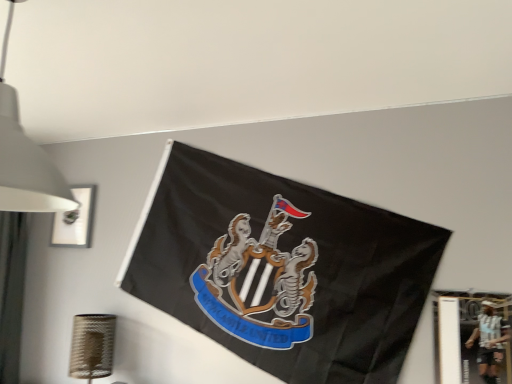
Image resolution: width=512 pixels, height=384 pixels. What do you see at coordinates (472, 337) in the screenshot?
I see `metallic silver picture frame at lower right, arranged as the first picture frame when viewed from the right` at bounding box center [472, 337].

What is the approximate width of metallic silver picture frame at lower right, positioned as the first picture frame in bottom-to-top order?

metallic silver picture frame at lower right, positioned as the first picture frame in bottom-to-top order, is 0.89 inches wide.

You are a GUI agent. You are given a task and a screenshot of the screen. Output one action in this format:
    pyautogui.click(x=<x>, y=<y>)
    Task: Click on the white matte lampshade at upper left
    The height and width of the screenshot is (384, 512).
    Given the screenshot: What is the action you would take?
    pyautogui.click(x=25, y=158)

At what (x,y) coordinates should I click in order to perform the action: click on matte white picture frame at upper left, the 1th picture frame positioned from the top. Please return your answer as a coordinate pair (x, y). This screenshot has height=384, width=512. Looking at the image, I should click on (75, 220).

Is white matte lampshade at upper left completely or partially outside of matte white picture frame at upper left, placed as the 1th picture frame when sorted from left to right?

Yes.

In the image, is white matte lampshade at upper left on the left side or the right side of matte white picture frame at upper left, which is the 1th picture frame from back to front?

From the image, it's evident that white matte lampshade at upper left is to the right of matte white picture frame at upper left, which is the 1th picture frame from back to front.

From the image's perspective, is white matte lampshade at upper left located above matte white picture frame at upper left, the 2th picture frame when ordered from right to left?

Correct, white matte lampshade at upper left appears higher than matte white picture frame at upper left, the 2th picture frame when ordered from right to left, in the image.

Based on the photo, would you consider matte white picture frame at upper left, which appears as the second picture frame when ordered from the bottom, to be distant from white matte lampshade at upper left?

Yes.

Find the location of a particular element. The width and height of the screenshot is (512, 384). picture frame on the left of white matte lampshade at upper left is located at coordinates (75, 220).

Is the position of matte white picture frame at upper left, the second picture frame from the front, less distant than that of white matte lampshade at upper left?

No, matte white picture frame at upper left, the second picture frame from the front, is further to the viewer.

Measure the distance from matte white picture frame at upper left, which is the 1th picture frame from back to front, to white matte lampshade at upper left.

matte white picture frame at upper left, which is the 1th picture frame from back to front, and white matte lampshade at upper left are 1.68 meters apart from each other.

Considering the positions of objects white matte lampshade at upper left and metallic silver picture frame at lower right, arranged as the second picture frame when viewed from the left, in the image provided, who is more to the right, white matte lampshade at upper left or metallic silver picture frame at lower right, arranged as the second picture frame when viewed from the left,?

From the viewer's perspective, metallic silver picture frame at lower right, arranged as the second picture frame when viewed from the left, appears more on the right side.

Is white matte lampshade at upper left in front of or behind metallic silver picture frame at lower right, arranged as the second picture frame when viewed from the left, in the image?

Clearly, white matte lampshade at upper left is in front of metallic silver picture frame at lower right, arranged as the second picture frame when viewed from the left.

Is point (7, 157) less distant than point (443, 370)?

That is True.

Is white matte lampshade at upper left shorter than metallic silver picture frame at lower right, which is the 1th picture frame from front to back?

Incorrect, the height of white matte lampshade at upper left does not fall short of that of metallic silver picture frame at lower right, which is the 1th picture frame from front to back.

Does metallic silver picture frame at lower right, positioned as the first picture frame in bottom-to-top order, have a smaller size compared to white matte lampshade at upper left?

Yes.

From a real-world perspective, is metallic silver picture frame at lower right, which is counted as the 2th picture frame, starting from the top, under white matte lampshade at upper left?

Yes.

Would you say white matte lampshade at upper left is part of metallic silver picture frame at lower right, arranged as the second picture frame when viewed from the left,'s contents?

No, white matte lampshade at upper left is not a part of metallic silver picture frame at lower right, arranged as the second picture frame when viewed from the left.

Considering the sizes of metallic silver picture frame at lower right, positioned as the 2th picture frame in back-to-front order, and white matte lampshade at upper left in the image, is metallic silver picture frame at lower right, positioned as the 2th picture frame in back-to-front order, taller or shorter than white matte lampshade at upper left?

metallic silver picture frame at lower right, positioned as the 2th picture frame in back-to-front order, is shorter than white matte lampshade at upper left.

Choose the correct answer: Is metallic silver picture frame at lower right, positioned as the 2th picture frame in back-to-front order, inside matte white picture frame at upper left, the 2th picture frame when ordered from right to left, or outside it?

metallic silver picture frame at lower right, positioned as the 2th picture frame in back-to-front order, is outside matte white picture frame at upper left, the 2th picture frame when ordered from right to left.

From a real-world perspective, between metallic silver picture frame at lower right, arranged as the first picture frame when viewed from the right, and matte white picture frame at upper left, the second picture frame from the front, who is vertically lower?

metallic silver picture frame at lower right, arranged as the first picture frame when viewed from the right, is physically lower.

Could you tell me if metallic silver picture frame at lower right, positioned as the first picture frame in bottom-to-top order, is turned towards matte white picture frame at upper left, the 2th picture frame when ordered from right to left?

No, metallic silver picture frame at lower right, positioned as the first picture frame in bottom-to-top order, does not turn towards matte white picture frame at upper left, the 2th picture frame when ordered from right to left.

Locate an element on the screen. The height and width of the screenshot is (384, 512). picture frame on the left of metallic silver picture frame at lower right, positioned as the 2th picture frame in back-to-front order is located at coordinates (75, 220).

Consider the image. Can you tell me how much matte white picture frame at upper left, which appears as the second picture frame when ordered from the bottom, and metallic silver picture frame at lower right, which is counted as the 2th picture frame, starting from the top, differ in facing direction?

matte white picture frame at upper left, which appears as the second picture frame when ordered from the bottom, and metallic silver picture frame at lower right, which is counted as the 2th picture frame, starting from the top, are facing 1.08 degrees away from each other.

From the image's perspective, which is below, matte white picture frame at upper left, the 1th picture frame positioned from the top, or metallic silver picture frame at lower right, positioned as the first picture frame in bottom-to-top order?

metallic silver picture frame at lower right, positioned as the first picture frame in bottom-to-top order, appears lower in the image.

Is metallic silver picture frame at lower right, which is counted as the 2th picture frame, starting from the top, a part of matte white picture frame at upper left, the 1th picture frame positioned from the top?

That's incorrect, metallic silver picture frame at lower right, which is counted as the 2th picture frame, starting from the top, is not inside matte white picture frame at upper left, the 1th picture frame positioned from the top.

This screenshot has height=384, width=512. Identify the location of the 1st picture frame below the white matte lampshade at upper left (from a real-world perspective). (75, 220).

I want to click on the 1st picture frame below the white matte lampshade at upper left (from the image's perspective), so click(x=75, y=220).

Which object lies nearer to the anchor point metallic silver picture frame at lower right, which is the 1th picture frame from front to back, white matte lampshade at upper left or matte white picture frame at upper left, which is the 1th picture frame from back to front?

The object closer to metallic silver picture frame at lower right, which is the 1th picture frame from front to back, is white matte lampshade at upper left.

Which object lies further to the anchor point white matte lampshade at upper left, matte white picture frame at upper left, the 2th picture frame when ordered from right to left, or metallic silver picture frame at lower right, which is counted as the 2th picture frame, starting from the top?

matte white picture frame at upper left, the 2th picture frame when ordered from right to left, lies further to white matte lampshade at upper left than the other object.

Considering their positions, is white matte lampshade at upper left positioned further to matte white picture frame at upper left, placed as the 1th picture frame when sorted from left to right, than metallic silver picture frame at lower right, arranged as the first picture frame when viewed from the right?

Among the two, metallic silver picture frame at lower right, arranged as the first picture frame when viewed from the right, is located further to matte white picture frame at upper left, placed as the 1th picture frame when sorted from left to right.

Considering their positions, is matte white picture frame at upper left, which is the 1th picture frame from back to front, positioned further to metallic silver picture frame at lower right, positioned as the 2th picture frame in back-to-front order, than white matte lampshade at upper left?

matte white picture frame at upper left, which is the 1th picture frame from back to front, is positioned further to the anchor metallic silver picture frame at lower right, positioned as the 2th picture frame in back-to-front order.

Looking at the image, which one is located closer to white matte lampshade at upper left, metallic silver picture frame at lower right, which is counted as the 2th picture frame, starting from the top, or matte white picture frame at upper left, the 2th picture frame when ordered from right to left?

metallic silver picture frame at lower right, which is counted as the 2th picture frame, starting from the top, lies closer to white matte lampshade at upper left than the other object.

Considering their positions, is metallic silver picture frame at lower right, which is the 1th picture frame from front to back, positioned closer to matte white picture frame at upper left, which appears as the second picture frame when ordered from the bottom, than white matte lampshade at upper left?

white matte lampshade at upper left is positioned closer to the anchor matte white picture frame at upper left, which appears as the second picture frame when ordered from the bottom.

At what (x,y) coordinates should I click in order to perform the action: click on lamp between matte white picture frame at upper left, the 2th picture frame when ordered from right to left, and metallic silver picture frame at lower right, positioned as the first picture frame in bottom-to-top order. Please return your answer as a coordinate pair (x, y). The height and width of the screenshot is (384, 512). Looking at the image, I should click on (25, 158).